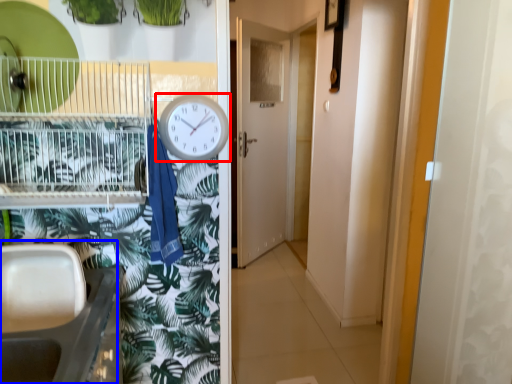
Question: Which object appears farthest to the camera in this image, clock (highlighted by a red box) or sink (highlighted by a blue box)?

Choices:
 (A) clock
 (B) sink

Answer: (A)